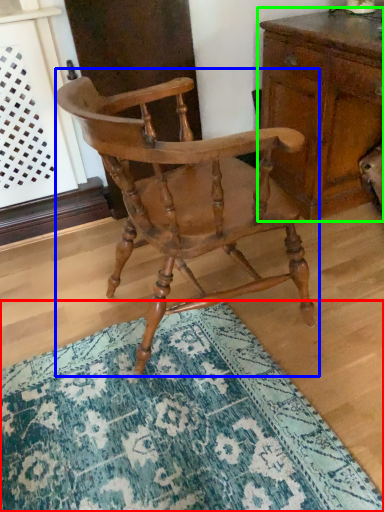
Question: Which object is positioned farthest from doormat (highlighted by a red box)? Select from chair (highlighted by a blue box) and chest of drawers (highlighted by a green box).

Choices:
 (A) chair
 (B) chest of drawers

Answer: (B)